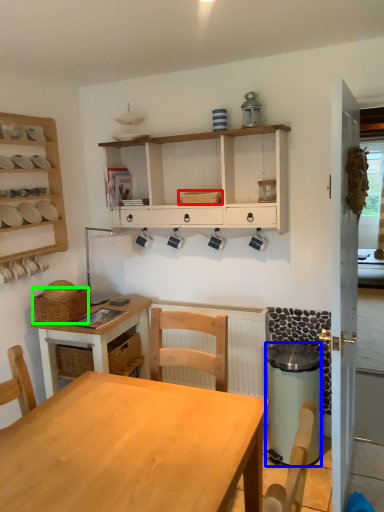
Question: Estimate the real-world distances between objects in this image. Which object is farther from basket (highlighted by a red box), trash bin/can (highlighted by a blue box) or basket (highlighted by a green box)?

Choices:
 (A) trash bin/can
 (B) basket

Answer: (A)